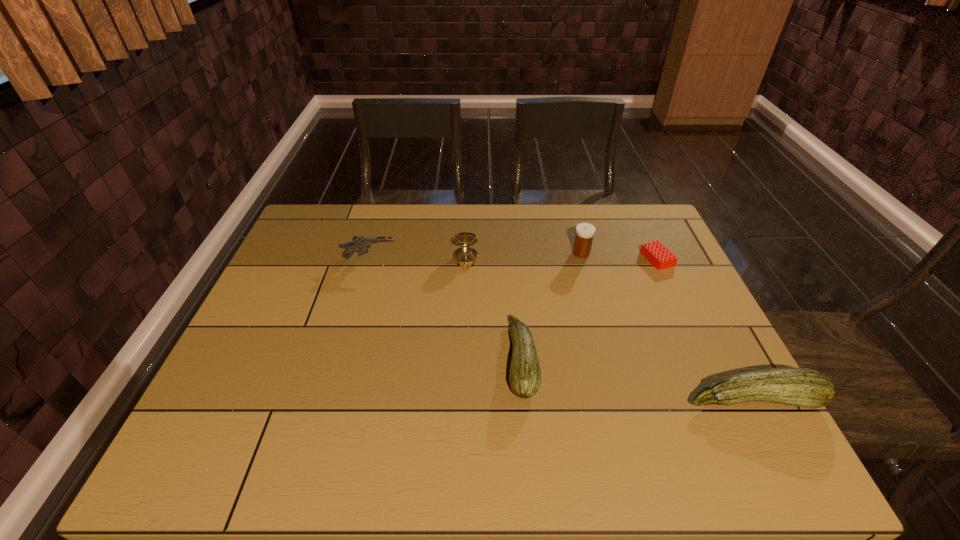
Where is `the shorter zucchini`? the shorter zucchini is located at coordinates (524, 375).

In order to click on the fourth object from right to left in this screenshot , I will do `click(524, 375)`.

Where is `the right zucchini`? the right zucchini is located at coordinates (800, 387).

Locate an element on the screen. the second object from left to right is located at coordinates (465, 256).

You are a GUI agent. You are given a task and a screenshot of the screen. Output one action in this format:
    pyautogui.click(x=<x>, y=<y>)
    Task: Click on the Lego
    The width and height of the screenshot is (960, 540).
    Given the screenshot: What is the action you would take?
    pyautogui.click(x=655, y=252)

This screenshot has height=540, width=960. I want to click on the leftmost object, so click(363, 242).

Identify the location of medicine. (584, 232).

Find the location of a particular element. free region located 0.240m at the stem end of the third object from left to right is located at coordinates (406, 360).

Where is `vacant area situated at the stem end of the third object from left to right`? The height and width of the screenshot is (540, 960). vacant area situated at the stem end of the third object from left to right is located at coordinates (448, 360).

Identify the location of vacant space located 0.290m at the stem end of the third object from left to right. (386, 360).